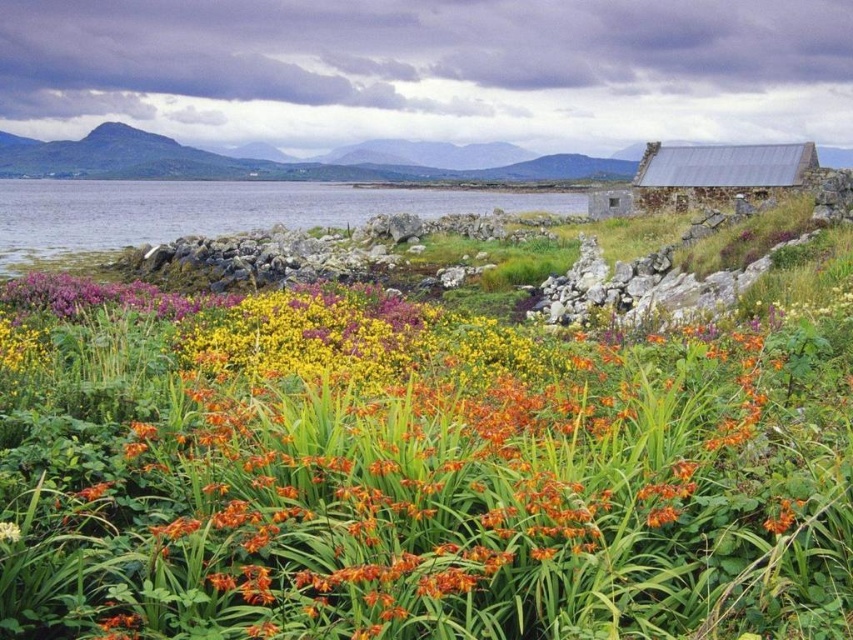
You are a photographer standing at the edge of the rocky shoreline. You want to capture a photo of the orange grass at center without the metallic gray hut at upper right appearing in the background. Is this possible based on their positions?

The orange grass at center is positioned under metallic gray hut at upper right, so the hut would likely appear in the background of the photo. To avoid the hut, the photographer would need to reposition themselves or use a different angle.

You are an environmental scientist assessing the coastal area. You need to determine which object, the orange grass at center or the metallic gray hut at upper right, would require more space for a new conservation project. Based on the scene, which one takes up more area?

The metallic gray hut at upper right occupies more space than the orange grass at center, so it would require more area for the conservation project.

Looking at this image, you are standing at the edge of the coastal landscape and want to take a photo. There are two points of interest marked as point 1 at coordinates point (x=509, y=442) and point 2 at coordinates point (x=144, y=236). Which point is closer to your current position?

Point (x=509, y=442) is closer to the camera than point (x=144, y=236), so point 1 is closer to your current position.